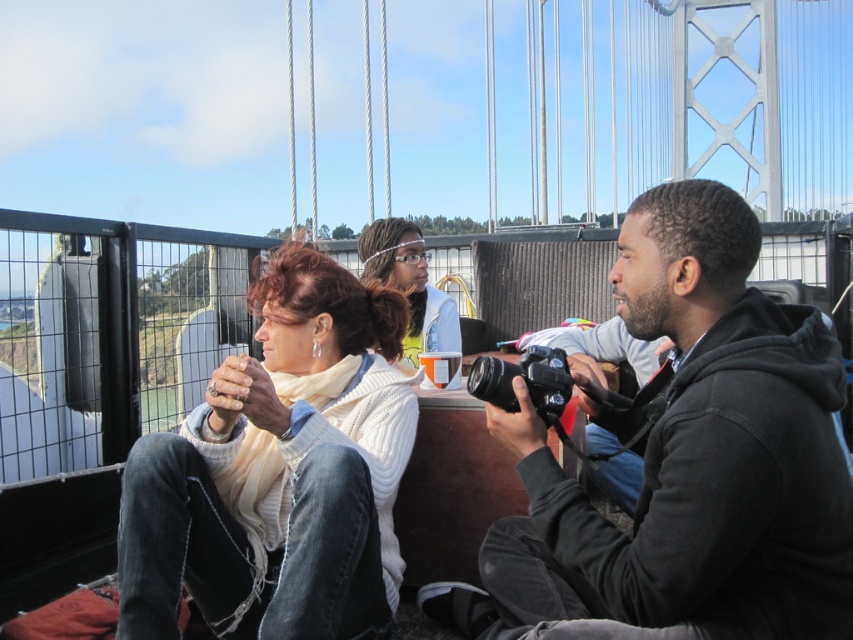
You are trying to distinguish between two white items in the image. The white knit sweater at center and the white matte hairband at center. Which one is located to the left?

The white knit sweater at center is positioned on the left side of the white matte hairband at center.

You are trying to determine which object takes up more visual space in the image between the white knit sweater at center and the white matte hairband at center. Based on the description, which one is larger in size?

The white knit sweater at center occupies less space than the white matte hairband at center, so the white matte hairband at center is larger in size.

You are standing on the bridge and want to take a photo of the three people. The black matte camera at center is between the woman on the left and the third person on the right. How far apart are the woman on the left and the third person on the right?

The woman on the left and the third person on the right are 3.95 feet apart.